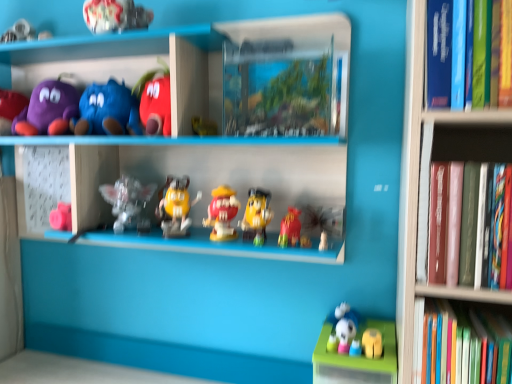
Question: Visually, is translucent plastic figurine at center, the 4th toy from the left, positioned to the left or to the right of hardcover book at right, the 3th book positioned from the top?

Choices:
 (A) right
 (B) left

Answer: (B)

Question: From a real-world perspective, is translucent plastic figurine at center, marked as the 7th toy in a right-to-left arrangement, positioned above or below hardcover book at right, the 3th book positioned from the top?

Choices:
 (A) above
 (B) below

Answer: (A)

Question: Which object is positioned closest to the hardcover book at right, which ranks as the 2th book in bottom-to-top order?

Choices:
 (A) matte red bag at center, the 9th toy when ordered from left to right
 (B) green plastic toy at lower right
 (C) matte plush toy at upper left, the eighth toy when ordered from right to left
 (D) yellow matte m&m figure at center, which is the fifth toy in right-to-left order
 (E) purple plush toy at left, arranged as the first toy when viewed from the left

Answer: (B)

Question: Considering the real-world distances, which object is farthest from the yellow matte m&m figure at center, which is the fifth toy in right-to-left order?

Choices:
 (A) matte yellow figure at center, the eighth toy viewed from the left
 (B) purple plush toy at upper left, the second toy viewed from the left
 (C) metallic silver toy at upper center, marked as the fifth toy in a left-to-right arrangement
 (D) matte plush toy at upper left, the eighth toy when ordered from right to left
 (E) yellow matte toy at lower right, the tenth toy when ordered from left to right

Answer: (E)